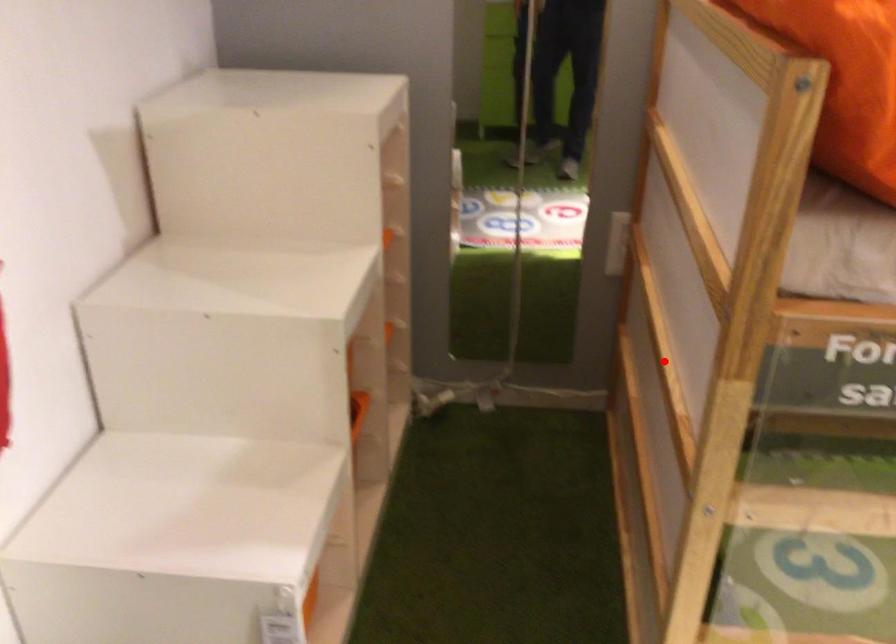
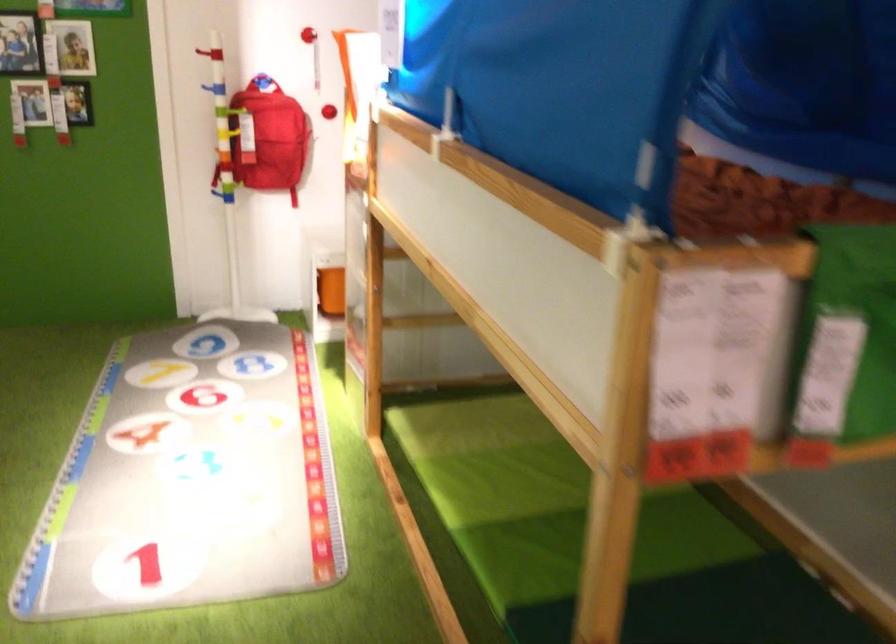
Question: I am providing you with two images of the same scene from different viewpoints. A red point is marked on the first image. At the location where the point appears in image 1, is it still visible in image 2?

Choices:
 (A) Yes
 (B) No

Answer: (B)